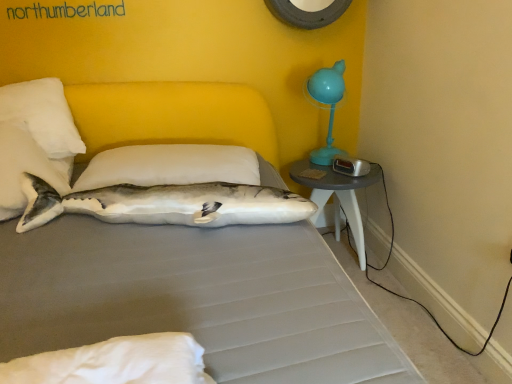
Question: Is white soft pillow at center, arranged as the 2th pillow when viewed from the left, in contact with white fabric shark at center?

Choices:
 (A) no
 (B) yes

Answer: (A)

Question: Is white fabric shark at center inside white soft pillow at center, arranged as the 2th pillow when viewed from the left?

Choices:
 (A) no
 (B) yes

Answer: (A)

Question: Does white soft pillow at center, which is the first pillow from right to left, appear on the right side of white fabric shark at center?

Choices:
 (A) yes
 (B) no

Answer: (B)

Question: Is white soft pillow at center, arranged as the 2th pillow when viewed from the left, looking in the opposite direction of white fabric shark at center?

Choices:
 (A) no
 (B) yes

Answer: (A)

Question: Considering the relative positions of white soft pillow at center, which is the first pillow from right to left, and white fabric shark at center in the image provided, is white soft pillow at center, which is the first pillow from right to left, to the left of white fabric shark at center from the viewer's perspective?

Choices:
 (A) yes
 (B) no

Answer: (A)

Question: From a real-world perspective, relative to white soft pillow at center, arranged as the 2th pillow when viewed from the left, is white fabric shark at center vertically above or below?

Choices:
 (A) above
 (B) below

Answer: (B)

Question: Is white fabric shark at center situated inside white soft pillow at center, arranged as the 2th pillow when viewed from the left, or outside?

Choices:
 (A) outside
 (B) inside

Answer: (A)

Question: From the image's perspective, relative to white soft pillow at center, arranged as the 2th pillow when viewed from the left, is white fabric shark at center above or below?

Choices:
 (A) above
 (B) below

Answer: (B)

Question: Considering the positions of white fabric shark at center and white soft pillow at center, which is the first pillow from right to left, in the image, is white fabric shark at center wider or thinner than white soft pillow at center, which is the first pillow from right to left,?

Choices:
 (A) wide
 (B) thin

Answer: (B)

Question: From a real-world perspective, is gray plastic nightstand at right positioned above or below white soft pillow at center, arranged as the 2th pillow when viewed from the left?

Choices:
 (A) below
 (B) above

Answer: (A)

Question: Visually, is gray plastic nightstand at right positioned to the left or to the right of white soft pillow at center, arranged as the 2th pillow when viewed from the left?

Choices:
 (A) right
 (B) left

Answer: (A)

Question: In terms of height, does gray plastic nightstand at right look taller or shorter compared to white soft pillow at center, which is the first pillow from right to left?

Choices:
 (A) short
 (B) tall

Answer: (B)

Question: In terms of size, does gray plastic nightstand at right appear bigger or smaller than white soft pillow at center, arranged as the 2th pillow when viewed from the left?

Choices:
 (A) small
 (B) big

Answer: (B)

Question: Is point (193, 182) positioned closer to the camera than point (344, 201)?

Choices:
 (A) closer
 (B) farther

Answer: (A)

Question: From the image's perspective, relative to gray plastic nightstand at right, is white soft pillow at center, arranged as the 2th pillow when viewed from the left, above or below?

Choices:
 (A) below
 (B) above

Answer: (B)